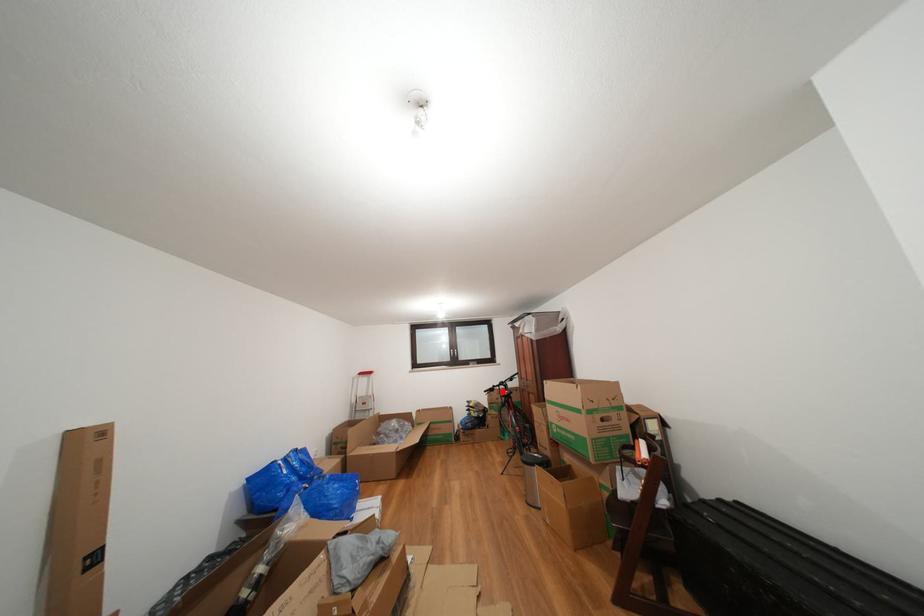
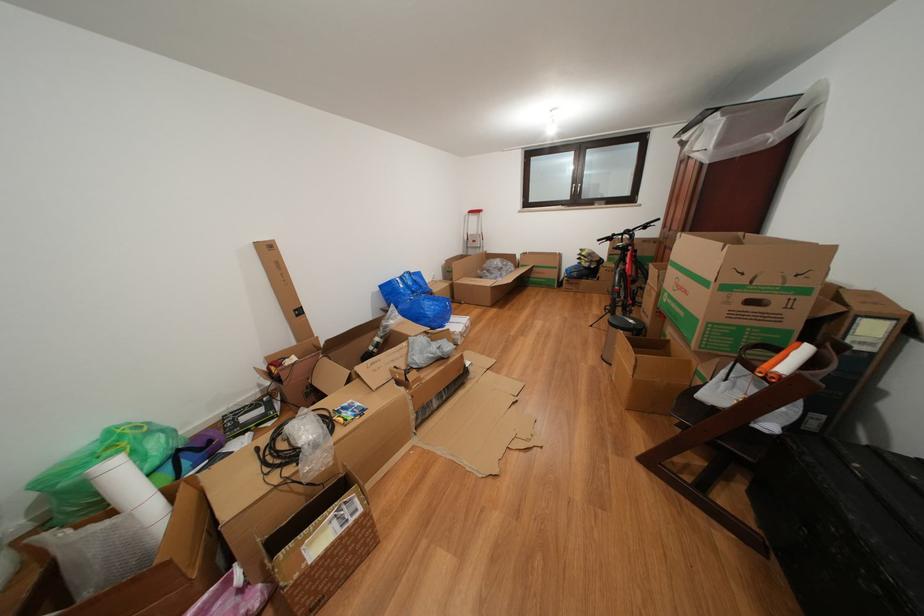
Locate, in the second image, the point that corresponds to the highlighted location in the first image.

(622, 240)